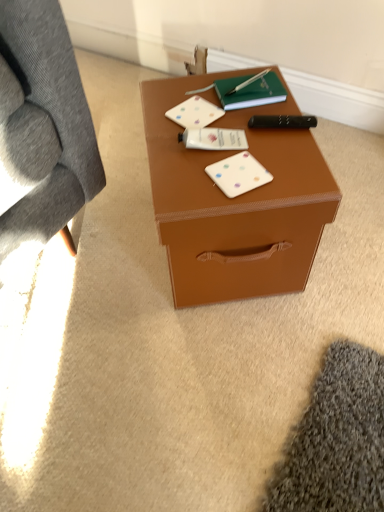
Question: Can you confirm if black plastic remote control at right is bigger than white matte card game at center, placed as the 2th card game when sorted from top to bottom?

Choices:
 (A) yes
 (B) no

Answer: (A)

Question: From a real-world perspective, is black plastic remote control at right on top of white matte card game at center, positioned as the first card game in front-to-back order?

Choices:
 (A) no
 (B) yes

Answer: (B)

Question: Is black plastic remote control at right wider than white matte card game at center, which ranks as the 2th card game in back-to-front order?

Choices:
 (A) yes
 (B) no

Answer: (B)

Question: Is black plastic remote control at right to the left of white matte card game at center, which is the 1th card game in bottom-to-top order, from the viewer's perspective?

Choices:
 (A) no
 (B) yes

Answer: (A)

Question: Is black plastic remote control at right positioned with its back to white matte card game at center, placed as the 2th card game when sorted from top to bottom?

Choices:
 (A) yes
 (B) no

Answer: (B)

Question: Is black plastic remote control at right facing towards white matte card game at center, which ranks as the 2th card game in back-to-front order?

Choices:
 (A) yes
 (B) no

Answer: (A)

Question: Is brown matte box at center completely or partially inside white matte card game at center, positioned as the first card game in front-to-back order?

Choices:
 (A) yes
 (B) no

Answer: (B)

Question: Does white matte card game at center, positioned as the first card game in front-to-back order, have a greater width compared to brown matte box at center?

Choices:
 (A) no
 (B) yes

Answer: (A)

Question: Is white matte card game at center, placed as the 2th card game when sorted from top to bottom, to the right of brown matte box at center from the viewer's perspective?

Choices:
 (A) no
 (B) yes

Answer: (B)

Question: Does white matte card game at center, which is the 1th card game in bottom-to-top order, have a greater height compared to brown matte box at center?

Choices:
 (A) yes
 (B) no

Answer: (B)

Question: Is white matte card game at center, which is the 1th card game in bottom-to-top order, outside brown matte box at center?

Choices:
 (A) no
 (B) yes

Answer: (A)

Question: Can you confirm if white matte card game at center, positioned as the first card game in front-to-back order, is thinner than brown matte box at center?

Choices:
 (A) yes
 (B) no

Answer: (A)

Question: Is white matte card game at center, which is counted as the 1th card game, starting from the top, oriented towards black plastic remote control at right?

Choices:
 (A) no
 (B) yes

Answer: (A)